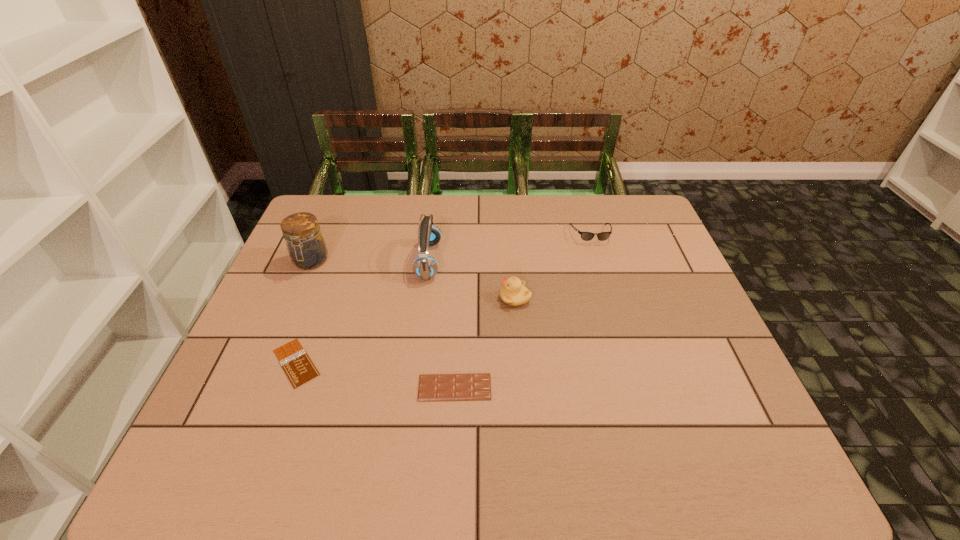
Find the location of a particular element. free space that is in between the fifth tallest object and the duckling is located at coordinates (485, 343).

Where is `free area in between the headset and the jar`? free area in between the headset and the jar is located at coordinates (370, 261).

Image resolution: width=960 pixels, height=540 pixels. I want to click on vacant area that lies between the rightmost object and the fourth farthest object, so tap(553, 266).

Locate an element on the screen. free space between the left chocolate bar and the second shortest object is located at coordinates (375, 375).

Where is `free area in between the sunglasses and the shorter chocolate bar`? The height and width of the screenshot is (540, 960). free area in between the sunglasses and the shorter chocolate bar is located at coordinates (444, 299).

Where is `free space that is in between the left chocolate bar and the jar`? The width and height of the screenshot is (960, 540). free space that is in between the left chocolate bar and the jar is located at coordinates (303, 312).

Where is `free space between the rightmost object and the fourth farthest object`? This screenshot has width=960, height=540. free space between the rightmost object and the fourth farthest object is located at coordinates (553, 266).

Choose which object is the second nearest neighbor to the headset. Please provide its 2D coordinates. Your answer should be formatted as a tuple, i.e. [(x, y)], where the tuple contains the x and y coordinates of a point satisfying the conditions above.

[(307, 249)]

Select which object appears as the closest to the jar. Please provide its 2D coordinates. Your answer should be formatted as a tuple, i.e. [(x, y)], where the tuple contains the x and y coordinates of a point satisfying the conditions above.

[(297, 365)]

Find the location of a particular element. free location that satisfies the following two spatial constraints: 1. on the ear cups of the headset; 2. on the lid of the jar is located at coordinates (428, 261).